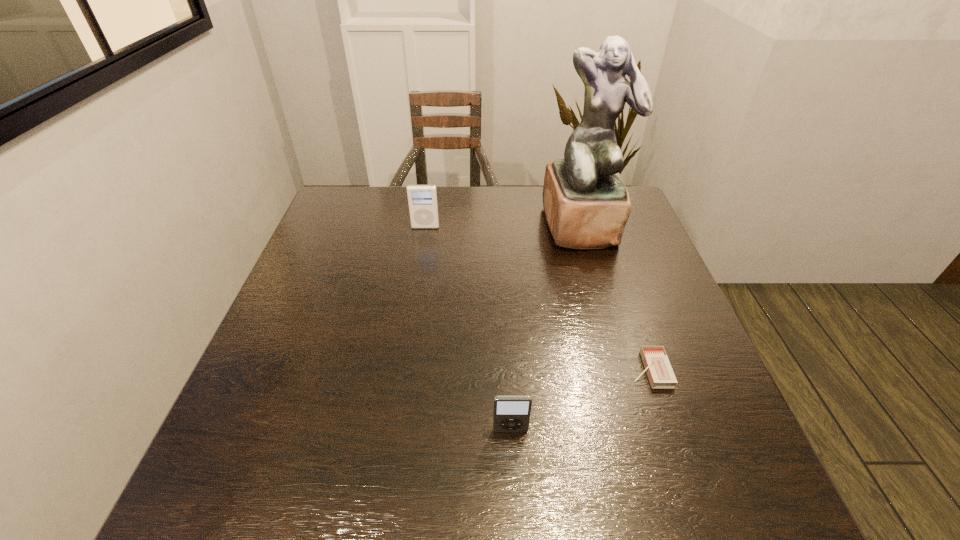
At what (x,y) coordinates should I click in order to perform the action: click on free space that is in between the second tallest object and the third farthest object. Please return your answer as a coordinate pair (x, y). This screenshot has width=960, height=540. Looking at the image, I should click on (538, 298).

Find the location of a particular element. The width and height of the screenshot is (960, 540). vacant point located between the matchbox and the left iPod is located at coordinates (538, 298).

Locate which object ranks in proximity to the nearest object. Please provide its 2D coordinates. Your answer should be formatted as a tuple, i.e. [(x, y)], where the tuple contains the x and y coordinates of a point satisfying the conditions above.

[(660, 373)]

Locate which object ranks in proximity to the leftmost object. Please provide its 2D coordinates. Your answer should be formatted as a tuple, i.e. [(x, y)], where the tuple contains the x and y coordinates of a point satisfying the conditions above.

[(586, 204)]

Identify the location of vacant space that satisfies the following two spatial constraints: 1. on the striking surface of the second nearest object; 2. on the front-facing side of the second object from left to right. The height and width of the screenshot is (540, 960). (x=670, y=431).

You are a GUI agent. You are given a task and a screenshot of the screen. Output one action in this format:
    pyautogui.click(x=<x>, y=<y>)
    Task: Click on the vacant space that satisfies the following two spatial constraints: 1. on the striking surface of the shortest object; 2. on the front-facing side of the second object from left to right
    
    Given the screenshot: What is the action you would take?
    tap(670, 431)